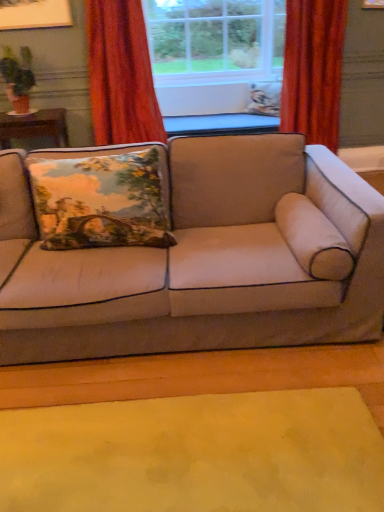
Question: In which direction should I rotate to look at floral fabric pillow at center, placed as the 2th pillow when sorted from bottom to top?

Choices:
 (A) right
 (B) left

Answer: (A)

Question: Should I look upward or downward to see beige fabric couch at center?

Choices:
 (A) up
 (B) down

Answer: (A)

Question: Considering the relative sizes of yellow felt mat at lower center and velvet floral pillow at left, which appears as the first pillow when viewed from the left, in the image provided, is yellow felt mat at lower center bigger than velvet floral pillow at left, which appears as the first pillow when viewed from the left,?

Choices:
 (A) yes
 (B) no

Answer: (B)

Question: From the image's perspective, does yellow felt mat at lower center appear lower than velvet floral pillow at left, which appears as the first pillow when viewed from the left?

Choices:
 (A) yes
 (B) no

Answer: (A)

Question: Can you confirm if yellow felt mat at lower center is positioned to the left of velvet floral pillow at left, which appears as the first pillow when viewed from the left?

Choices:
 (A) yes
 (B) no

Answer: (B)

Question: Is yellow felt mat at lower center wider than velvet floral pillow at left, which is the first pillow in bottom-to-top order?

Choices:
 (A) yes
 (B) no

Answer: (A)

Question: From a real-world perspective, is yellow felt mat at lower center on velvet floral pillow at left, which is the first pillow in bottom-to-top order?

Choices:
 (A) yes
 (B) no

Answer: (B)

Question: Does yellow felt mat at lower center have a greater height compared to velvet floral pillow at left, the first pillow from the front?

Choices:
 (A) no
 (B) yes

Answer: (A)

Question: From a real-world perspective, does matte brown pot at left stand above velvet orange curtain at upper left, the 1th curtain viewed from the left?

Choices:
 (A) yes
 (B) no

Answer: (A)

Question: Is velvet orange curtain at upper left, the second curtain when ordered from right to left, surrounded by matte brown pot at left?

Choices:
 (A) yes
 (B) no

Answer: (B)

Question: Could you tell me if matte brown pot at left is turned towards velvet orange curtain at upper left, the second curtain when ordered from right to left?

Choices:
 (A) yes
 (B) no

Answer: (B)

Question: Can you confirm if matte brown pot at left is positioned to the right of velvet orange curtain at upper left, the 1th curtain viewed from the left?

Choices:
 (A) no
 (B) yes

Answer: (A)

Question: Is matte brown pot at left closer to the viewer compared to velvet orange curtain at upper left, the second curtain when ordered from right to left?

Choices:
 (A) no
 (B) yes

Answer: (A)

Question: Is matte brown pot at left located outside velvet orange curtain at upper left, the second curtain when ordered from right to left?

Choices:
 (A) no
 (B) yes

Answer: (B)

Question: Is velvet-like red curtain at right, positioned as the second curtain in left-to-right order, smaller than floral fabric pillow at center, marked as the 1th pillow in a right-to-left arrangement?

Choices:
 (A) yes
 (B) no

Answer: (B)